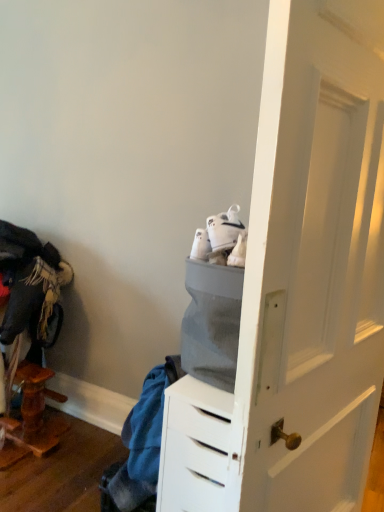
Question: Is point (228, 245) closer or farther from the camera than point (157, 449)?

Choices:
 (A) closer
 (B) farther

Answer: (A)

Question: From the image's perspective, is white suede sneakers at center located above or below blue fabric at lower left?

Choices:
 (A) above
 (B) below

Answer: (A)

Question: Relative to blue fabric at lower left, is white suede sneakers at center in front or behind?

Choices:
 (A) behind
 (B) front

Answer: (B)

Question: Is blue fabric at lower left in front of or behind white suede sneakers at center in the image?

Choices:
 (A) front
 (B) behind

Answer: (B)

Question: In terms of width, does blue fabric at lower left look wider or thinner when compared to white suede sneakers at center?

Choices:
 (A) wide
 (B) thin

Answer: (A)

Question: Is point (140, 412) positioned closer to the camera than point (221, 230)?

Choices:
 (A) farther
 (B) closer

Answer: (A)

Question: Considering the positions of blue fabric at lower left and white suede sneakers at center in the image, is blue fabric at lower left taller or shorter than white suede sneakers at center?

Choices:
 (A) short
 (B) tall

Answer: (B)